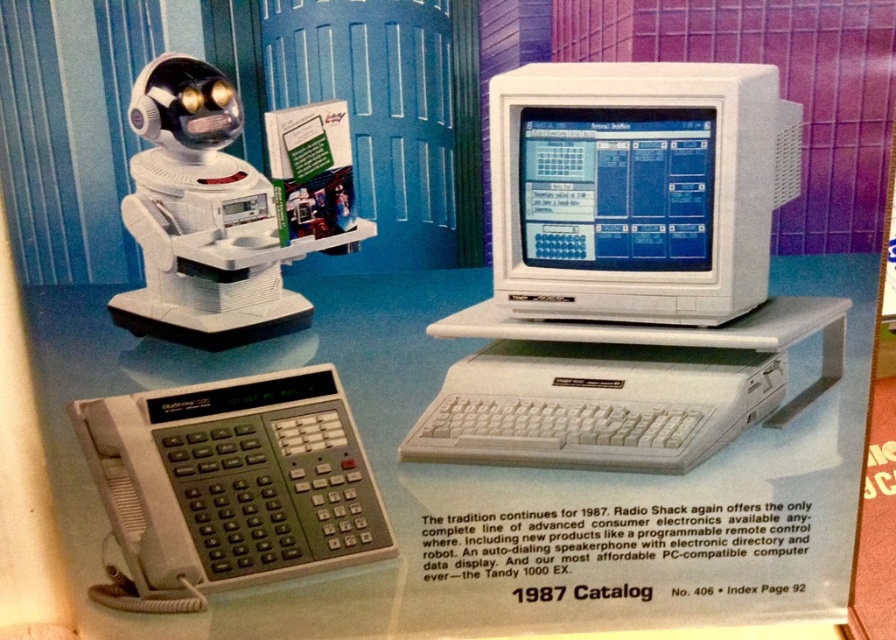
You are standing in front of the vintage Radio Shack advertisement and notice two points marked on the image. Which point is closer to you, point (717, 253) or point (602, 147)?

Point (717, 253) is further to the viewer than point (602, 147), so point (602, 147) is closer to you.